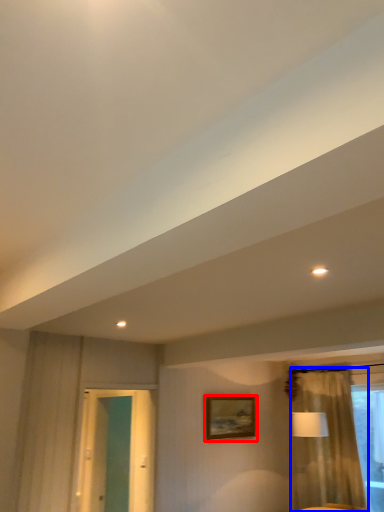
Question: Among these objects, which one is nearest to the camera, picture frame (highlighted by a red box) or curtain (highlighted by a blue box)?

Choices:
 (A) picture frame
 (B) curtain

Answer: (B)